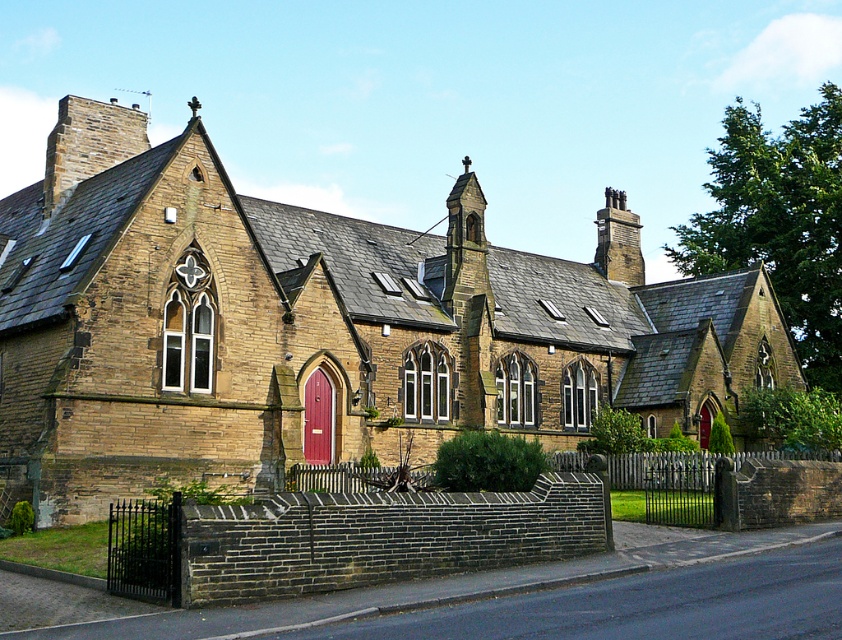
Is brown stone church at center below matte wooden door at center?

No, brown stone church at center is not below matte wooden door at center.

Does brown stone church at center have a greater width compared to matte wooden door at center?

Yes, brown stone church at center is wider than matte wooden door at center.

Is point (537, 284) positioned behind point (313, 419)?

Yes, point (537, 284) is farther from viewer.

Locate an element on the screen. This screenshot has height=640, width=842. brown stone church at center is located at coordinates (318, 324).